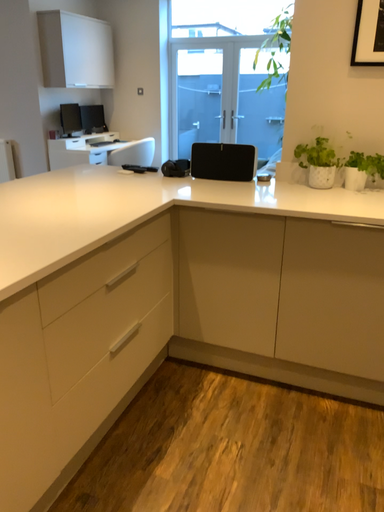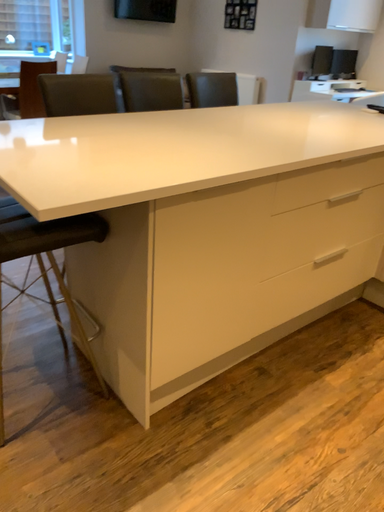
Question: How did the camera likely rotate when shooting the video?

Choices:
 (A) rotated right
 (B) rotated left

Answer: (B)